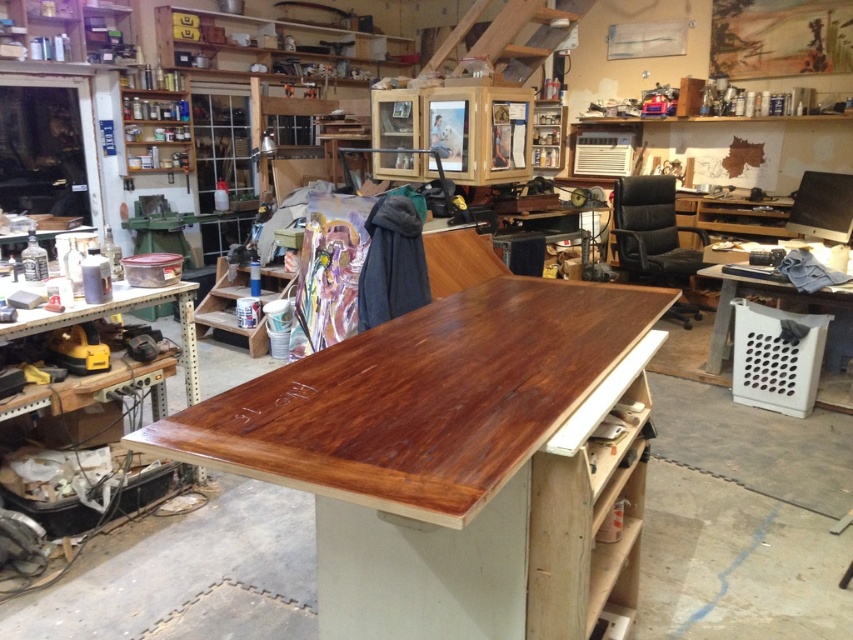
Question: In this image, where is shiny wood table at center located relative to wooden workbench at left?

Choices:
 (A) below
 (B) above

Answer: (A)

Question: Which point is farther to the camera?

Choices:
 (A) (57, 316)
 (B) (814, 292)

Answer: (B)

Question: Which object is farther from the camera taking this photo?

Choices:
 (A) shiny wood table at center
 (B) wooden crate at lower right
 (C) wooden workbench at left

Answer: (B)

Question: Can you confirm if shiny wood table at center is wider than wooden workbench at left?

Choices:
 (A) no
 (B) yes

Answer: (B)

Question: Where is shiny wood table at center located in relation to wooden workbench at left in the image?

Choices:
 (A) below
 (B) above

Answer: (A)

Question: Which object is positioned farthest from the wooden workbench at left?

Choices:
 (A) shiny wood table at center
 (B) wooden crate at lower right

Answer: (B)